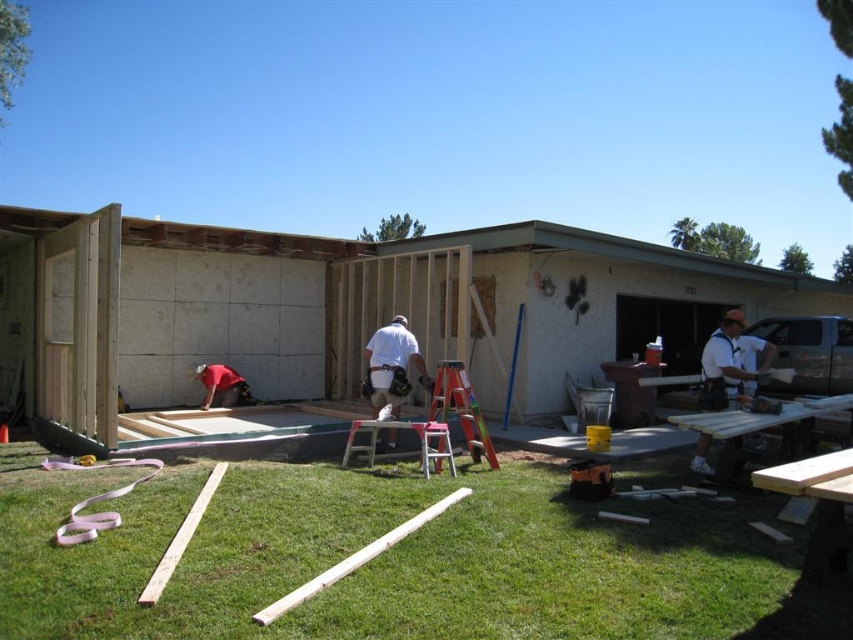
Question: Is white smooth shirt at right below white matte shirt at center?

Choices:
 (A) yes
 (B) no

Answer: (B)

Question: Which point appears farthest from the camera in this image?

Choices:
 (A) (393, 396)
 (B) (467, 416)
 (C) (730, 353)

Answer: (A)

Question: Among these objects, which one is nearest to the camera?

Choices:
 (A) orange fiberglass ladder at center
 (B) white smooth shirt at right

Answer: (B)

Question: Does orange fiberglass ladder at center have a larger size compared to red fabric construction worker at lower left?

Choices:
 (A) yes
 (B) no

Answer: (A)

Question: Does white smooth shirt at right appear under white matte shirt at center?

Choices:
 (A) no
 (B) yes

Answer: (A)

Question: Estimate the real-world distances between objects in this image. Which object is closer to the white smooth shirt at right?

Choices:
 (A) white matte shirt at center
 (B) orange fiberglass ladder at center
 (C) red fabric construction worker at lower left

Answer: (B)